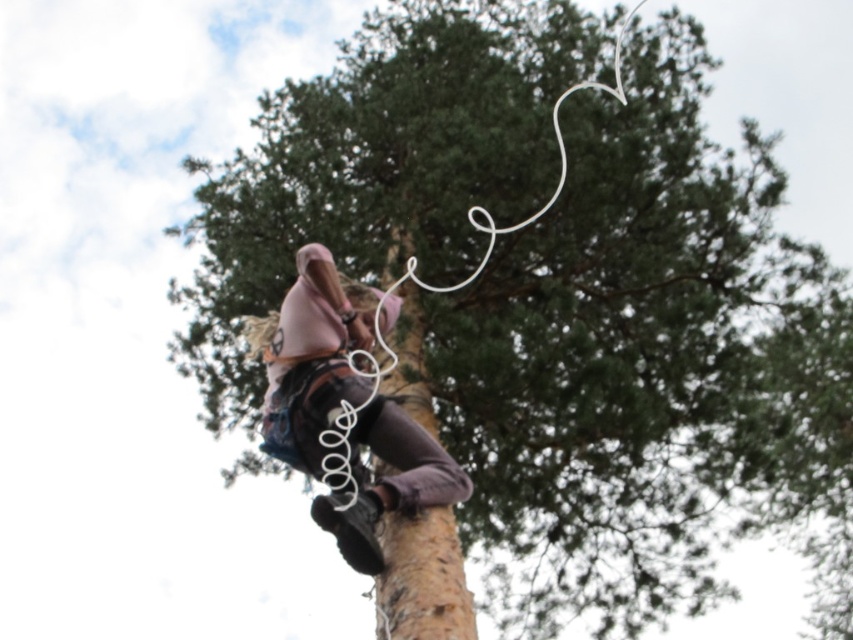
You are a tree climber wearing a pink hooded jacket and dark pants. You are at point (312, 358). You want to reach the pink fabric at center. Which direction should you move? The tree is large coniferous type with dense green foliage. The sky is overcast.

The pink fabric at center is located at point (312, 358), so you are already at the pink fabric at center.

You are a safety inspector checking the setup of a tree climbing activity. You notice the pink fabric at center and the brown rough tree trunk at center. According to safety guidelines, the minimum safe distance between the climber and the tree trunk should be 36 inches. Is the current distance compliant with the safety standards?

The pink fabric at center is 34.53 inches away from the brown rough tree trunk at center. Since 34.53 inches is less than the required 36 inches, the current distance does not comply with the safety standards.